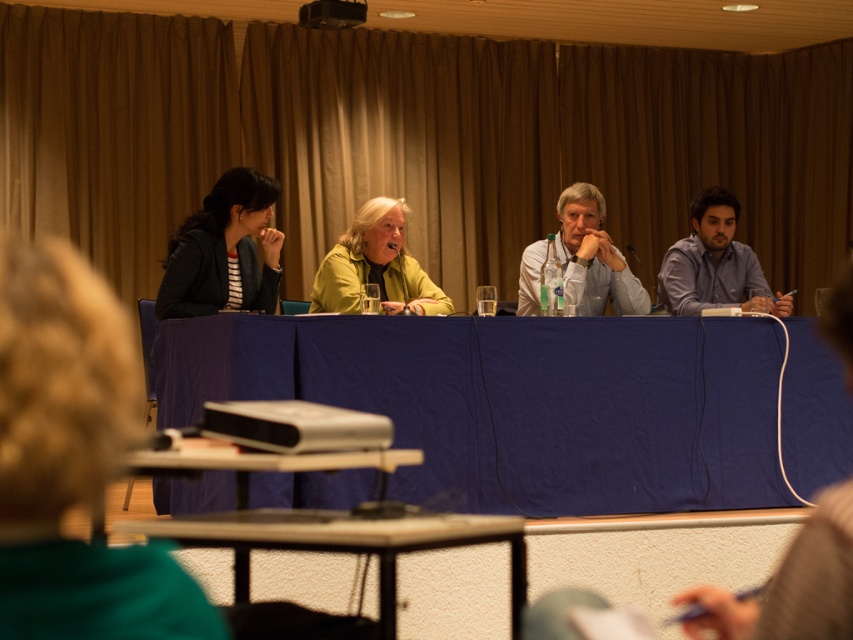
You are attending the panel discussion and want to approach the speaker who is at point (503, 522). If you are standing 7.60 feet away from this point, is the distance sufficient to hear the speaker clearly without any amplification?

The distance between you and the speaker at point (503, 522) is 7.60 feet. This distance is typically sufficient to hear the speaker clearly without amplification, as it is within a reasonable conversational range.

You are organizing a photoshoot and need to arrange two jackets from the panel discussion scene for a display. The jackets are the dark gray fabric jacket at left and the matte yellow jacket at center. Which jacket should you choose if you want to place a larger jacket on a mannequin first?

The matte yellow jacket at center is larger than the dark gray fabric jacket at left, so you should place the matte yellow jacket at center on the mannequin first.

You are attending the panel discussion and need to identify the location of the dark gray fabric jacket at left. Based on the coordinates provided, can you determine its position relative to the table?

The dark gray fabric jacket at left is located at point coordinates of 0.392 on the x and 0.263 on the y axis, which places it on the left side of the table.